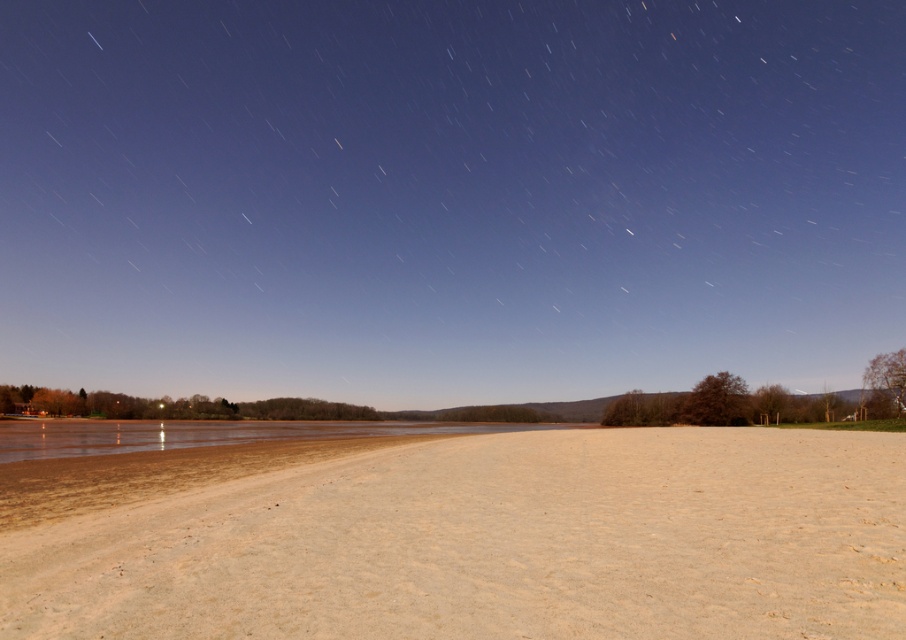
Question: Where is smooth sand at lower center located in relation to sandy beige dirt field at lower center in the image?

Choices:
 (A) right
 (B) left

Answer: (B)

Question: Which object appears closest to the camera in this image?

Choices:
 (A) sandy beige dirt field at lower center
 (B) smooth sand at lower center

Answer: (A)

Question: Is smooth sand at lower center positioned behind sandy beige dirt field at lower center?

Choices:
 (A) no
 (B) yes

Answer: (B)

Question: Does smooth sand at lower center come in front of sandy beige dirt field at lower center?

Choices:
 (A) no
 (B) yes

Answer: (A)

Question: Which point appears farthest from the camera in this image?

Choices:
 (A) (495, 440)
 (B) (214, 115)

Answer: (B)

Question: Which object is closer to the camera taking this photo?

Choices:
 (A) smooth sand at lower center
 (B) sandy beige dirt field at lower center

Answer: (B)